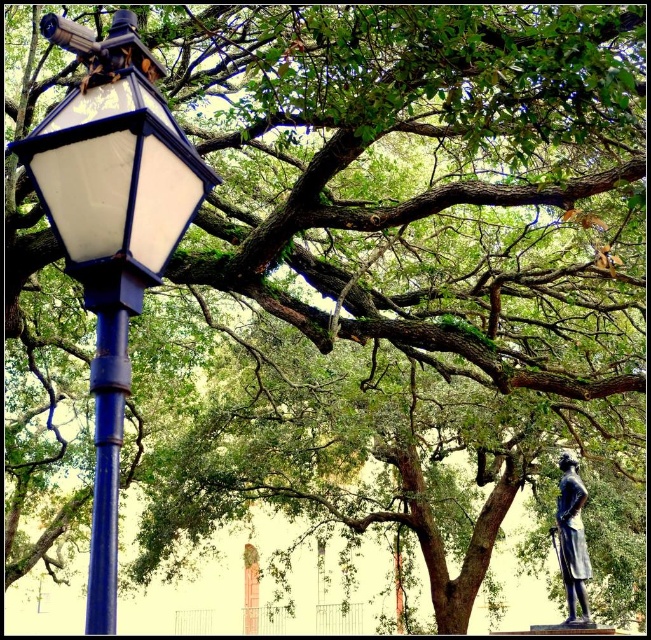
You are standing in the middle of the scene and want to locate the matte blue streetlight at left. According to the coordinates provided, in which direction should you look to find it?

The matte blue streetlight at left is located at coordinates point (x=111, y=230). Since you are standing in the middle of the scene, you should look to the left side to find it.

You are standing in the park and see the blue metallic pole at left and the bronze statue at lower right. Which object is closer to the front of the scene?

The blue metallic pole at left is positioned over the bronze statue at lower right, meaning it is closer to the front of the scene.